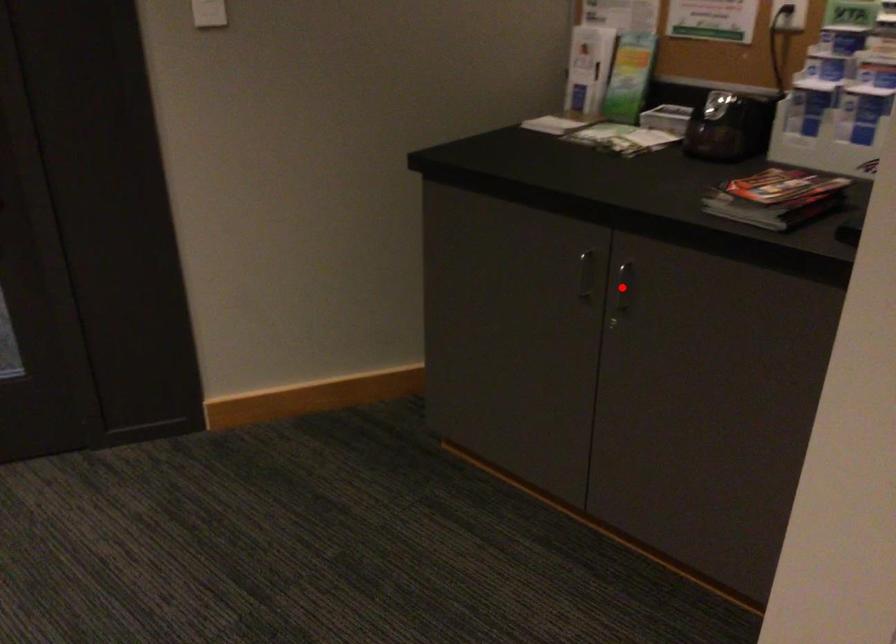
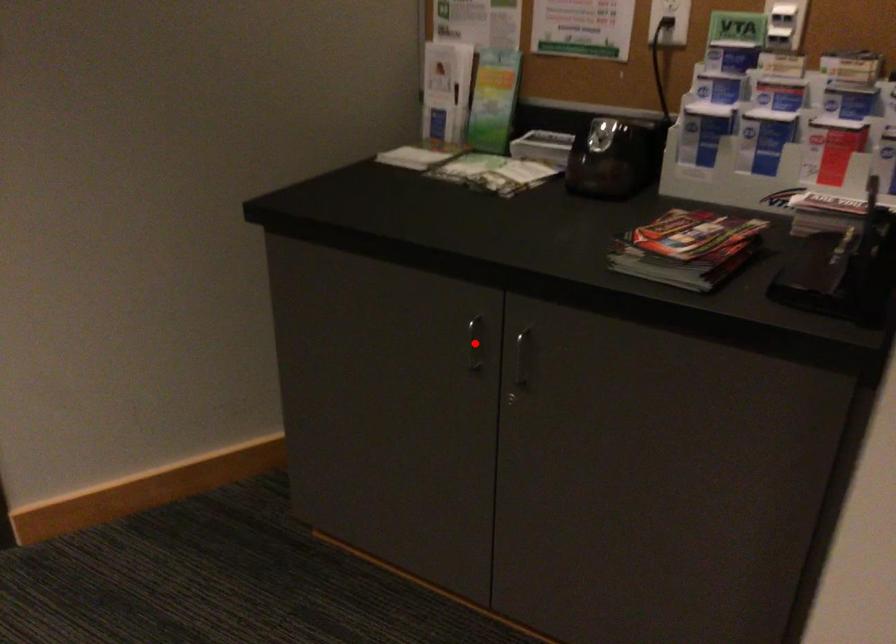
I am providing you with two images of the same scene from different viewpoints. A red point is marked on the first image and another point is marked on the second image. Does the point marked in image1 correspond to the same location as the one in image2?

No